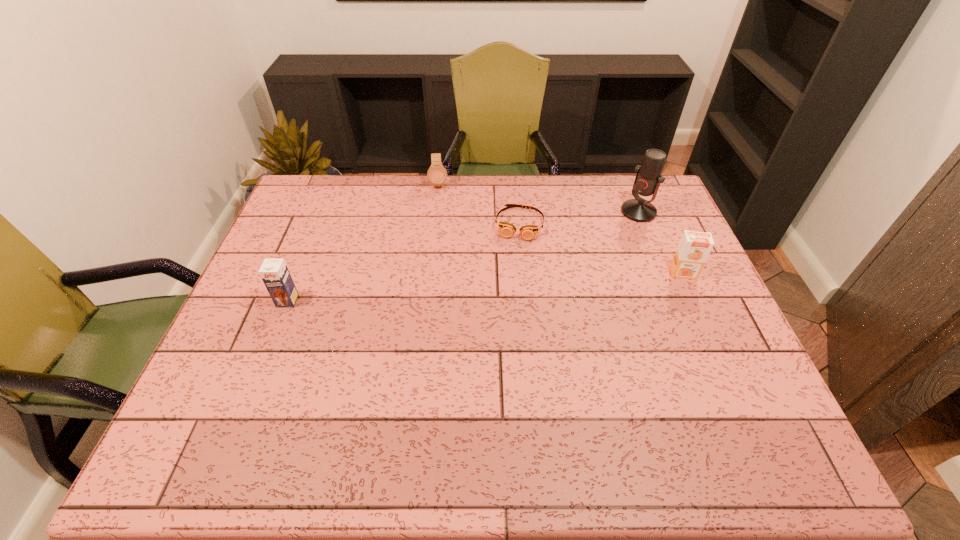
The width and height of the screenshot is (960, 540). Find the location of `free space that is in between the orange juice and the tallest object`. free space that is in between the orange juice and the tallest object is located at coordinates (660, 242).

At what (x,y) coordinates should I click in order to perform the action: click on vacant area that lies between the third object from left to right and the tallest object. Please return your answer as a coordinate pair (x, y). The height and width of the screenshot is (540, 960). Looking at the image, I should click on (579, 218).

Identify which object is the second nearest to the tallest object. Please provide its 2D coordinates. Your answer should be formatted as a tuple, i.e. [(x, y)], where the tuple contains the x and y coordinates of a point satisfying the conditions above.

[(528, 232)]

Where is `object that is the second closest to the farthest object`? The height and width of the screenshot is (540, 960). object that is the second closest to the farthest object is located at coordinates (274, 272).

Where is `vacant space that satisfies the following two spatial constraints: 1. on the front side of the microphone; 2. on the right side of the watch`? This screenshot has height=540, width=960. vacant space that satisfies the following two spatial constraints: 1. on the front side of the microphone; 2. on the right side of the watch is located at coordinates (436, 212).